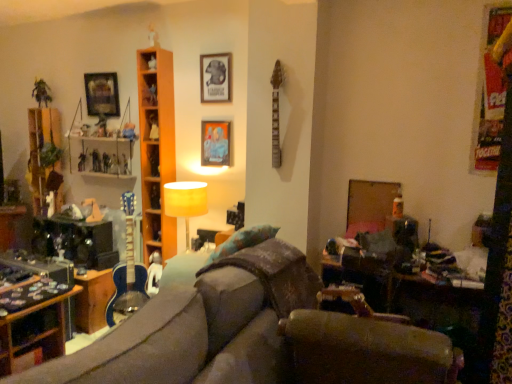
Question: From their relative heights in the image, would you say metallic silver toy at center, positioned as the second toy in right-to-left order, is taller or shorter than matte black picture frame at upper center, which ranks as the 1th picture frame in front-to-back order?

Choices:
 (A) tall
 (B) short

Answer: (B)

Question: Considering their positions, is metallic silver toy at center, positioned as the second toy in right-to-left order, located in front of or behind matte black picture frame at upper center, the 3th picture frame from the back?

Choices:
 (A) front
 (B) behind

Answer: (B)

Question: Which of these objects is positioned farthest from the velvet brown couch at center?

Choices:
 (A) metallic figure at left, positioned as the fifth toy in right-to-left order
 (B) shiny plastic action figure at left, which ranks as the 3th toy in right-to-left order
 (C) metallic silver toy at center, positioned as the second toy in right-to-left order
 (D) metallic silver figurine at upper left, positioned as the 4th toy in right-to-left order
 (E) wooden table at lower right

Answer: (A)

Question: Based on their relative distances, which object is nearer to the matte black picture frame at upper center, which is counted as the 3th picture frame, starting from the left?

Choices:
 (A) textured fabric pillow at center
 (B) shiny plastic action figure at left, which is the 3th toy in left-to-right order
 (C) metallic blue guitar at center-left, which is the 5th toy from left to right
 (D) metallic figure at left, which is the first toy from left to right
 (E) metallic silver toy at center, which ranks as the 4th toy in left-to-right order

Answer: (C)